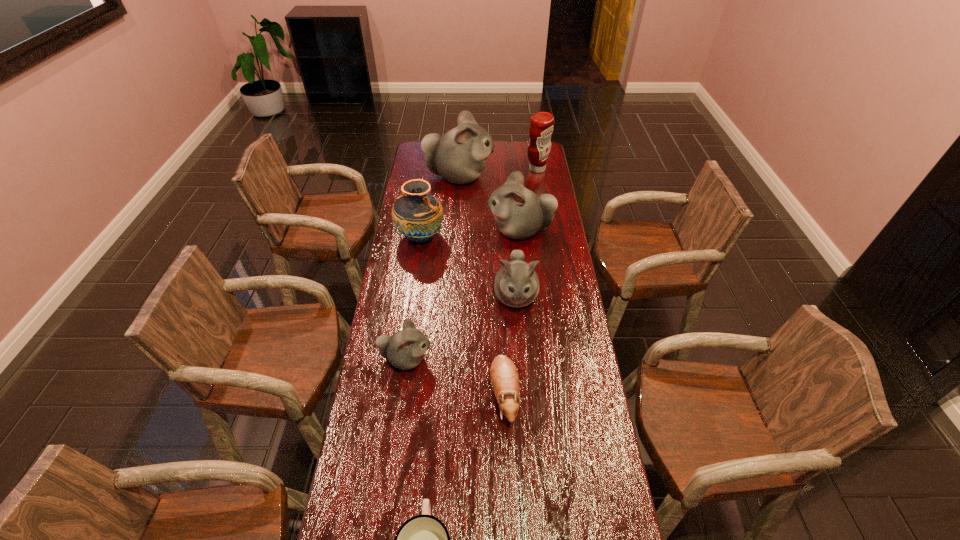
Locate an element on the screen. This screenshot has height=540, width=960. the farthest white hamster is located at coordinates (459, 156).

Identify the location of the biggest white hamster. The width and height of the screenshot is (960, 540). (459, 156).

The image size is (960, 540). In order to click on condiment in this screenshot , I will do `click(541, 128)`.

Locate an element on the screen. Image resolution: width=960 pixels, height=540 pixels. pottery is located at coordinates (418, 216).

This screenshot has width=960, height=540. Identify the location of the third smallest white hamster. click(519, 213).

The width and height of the screenshot is (960, 540). Identify the location of the fourth shortest hamster. (519, 213).

Where is `the fourth nearest object`? This screenshot has height=540, width=960. the fourth nearest object is located at coordinates (516, 284).

The width and height of the screenshot is (960, 540). I want to click on the fourth shortest object, so click(516, 284).

Where is `the smallest white hamster`? the smallest white hamster is located at coordinates (405, 349).

Find the location of a particular element. the sixth tallest object is located at coordinates (405, 349).